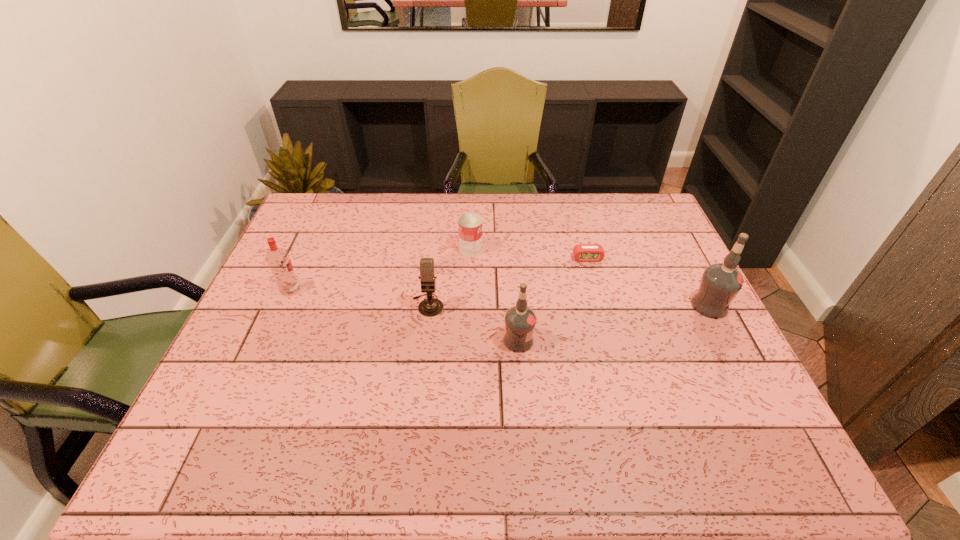
Image resolution: width=960 pixels, height=540 pixels. In order to click on free space located 0.130m on the front label of the third object from right to left in this screenshot , I will do `click(584, 340)`.

The height and width of the screenshot is (540, 960). Find the location of `vacant point located on the front-facing side of the second object from right to left`. vacant point located on the front-facing side of the second object from right to left is located at coordinates (618, 369).

Locate an element on the screen. The height and width of the screenshot is (540, 960). vacant space located 0.180m on the front label of the fourth object from right to left is located at coordinates (539, 249).

Identify the location of vacant space positioned 0.310m on the front-facing side of the fifth object from right to left. (414, 421).

The height and width of the screenshot is (540, 960). Identify the location of vacant space located 0.110m on the front label of the leftmost vodka. (338, 290).

Identify the location of object that is positioned at the left edge. (278, 259).

Identify the location of object present at the right edge. (720, 283).

Where is `free space at the far edge`? The height and width of the screenshot is (540, 960). free space at the far edge is located at coordinates (x=386, y=196).

In the image, there is a desktop. Identify the location of vacant space at the near edge. (497, 391).

At what (x,y) coordinates should I click in order to perform the action: click on free space at the left edge. Please return your answer as a coordinate pair (x, y). Looking at the image, I should click on (298, 244).